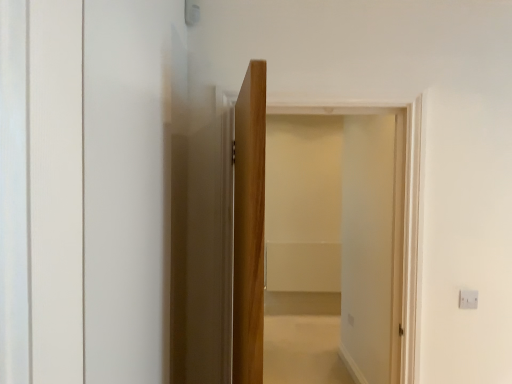
The image size is (512, 384). I want to click on light brown wood door at center, so pos(222,241).

The width and height of the screenshot is (512, 384). Describe the element at coordinates (222, 241) in the screenshot. I see `light brown wood door at center` at that location.

The height and width of the screenshot is (384, 512). Describe the element at coordinates (341, 224) in the screenshot. I see `clear glass screen door at center` at that location.

Measure the distance between clear glass screen door at center and camera.

They are 13.48 feet apart.

What are the coordinates of `clear glass screen door at center` in the screenshot? It's located at (341, 224).

I want to click on light brown wood door at center, so click(222, 241).

Which is more to the left, light brown wood door at center or clear glass screen door at center?

light brown wood door at center is more to the left.

Is light brown wood door at center in front of clear glass screen door at center?

Yes, light brown wood door at center is closer to the camera.

Which is in front, point (212, 146) or point (370, 234)?

The point (212, 146) is in front.

From the image's perspective, between light brown wood door at center and clear glass screen door at center, who is located below?

light brown wood door at center appears lower in the image.

From a real-world perspective, is light brown wood door at center physically above clear glass screen door at center?

Yes, from a real-world perspective, light brown wood door at center is over clear glass screen door at center

Considering the sizes of objects light brown wood door at center and clear glass screen door at center in the image provided, who is wider, light brown wood door at center or clear glass screen door at center?

clear glass screen door at center is wider.

Considering the sizes of objects light brown wood door at center and clear glass screen door at center in the image provided, who is shorter, light brown wood door at center or clear glass screen door at center?

light brown wood door at center is shorter.

Based on the photo, based on their sizes in the image, would you say light brown wood door at center is bigger or smaller than clear glass screen door at center?

Considering their sizes, light brown wood door at center takes up less space than clear glass screen door at center.

From the picture: Is light brown wood door at center inside the boundaries of clear glass screen door at center, or outside?

light brown wood door at center exists outside the volume of clear glass screen door at center.

Is light brown wood door at center not near clear glass screen door at center?

Yes, light brown wood door at center and clear glass screen door at center are quite far apart.

Is clear glass screen door at center at the back of light brown wood door at center?

No, light brown wood door at center is not facing the opposite direction of clear glass screen door at center.

What's the angular difference between light brown wood door at center and clear glass screen door at center's facing directions?

There is a 83.7-degree angle between the facing directions of light brown wood door at center and clear glass screen door at center.

Identify the location of elevator lying below the clear glass screen door at center (from the image's perspective). The height and width of the screenshot is (384, 512). (222, 241).

Considering the positions of objects clear glass screen door at center and light brown wood door at center in the image provided, who is more to the left, clear glass screen door at center or light brown wood door at center?

light brown wood door at center.

Considering their positions, is clear glass screen door at center located in front of or behind light brown wood door at center?

Visually, clear glass screen door at center is located behind light brown wood door at center.

Is point (281, 121) more distant than point (242, 157)?

Yes, point (281, 121) is behind point (242, 157).

From the image's perspective, is clear glass screen door at center located above or below light brown wood door at center?

clear glass screen door at center is above light brown wood door at center.

From a real-world perspective, is clear glass screen door at center over light brown wood door at center?

No.

Is clear glass screen door at center wider or thinner than light brown wood door at center?

Considering their sizes, clear glass screen door at center looks broader than light brown wood door at center.

Considering the sizes of objects clear glass screen door at center and light brown wood door at center in the image provided, who is shorter, clear glass screen door at center or light brown wood door at center?

With less height is light brown wood door at center.

Consider the image. Which of these two, clear glass screen door at center or light brown wood door at center, is bigger?

Bigger between the two is clear glass screen door at center.

Is clear glass screen door at center located outside light brown wood door at center?

Absolutely, clear glass screen door at center is external to light brown wood door at center.

Is clear glass screen door at center far from light brown wood door at center?

Indeed, clear glass screen door at center is not near light brown wood door at center.

Is clear glass screen door at center positioned with its back to light brown wood door at center?

No, clear glass screen door at center's orientation is not away from light brown wood door at center.

What's the angular difference between clear glass screen door at center and light brown wood door at center's facing directions?

They differ by 83.7 degrees in their facing directions.

Where is `screen door on the right of light brown wood door at center`? The width and height of the screenshot is (512, 384). screen door on the right of light brown wood door at center is located at coordinates (341, 224).

The width and height of the screenshot is (512, 384). In order to click on screen door that is under the light brown wood door at center (from a real-world perspective) in this screenshot , I will do `click(341, 224)`.

Locate an element on the screen. Image resolution: width=512 pixels, height=384 pixels. screen door lying on the right of light brown wood door at center is located at coordinates (341, 224).